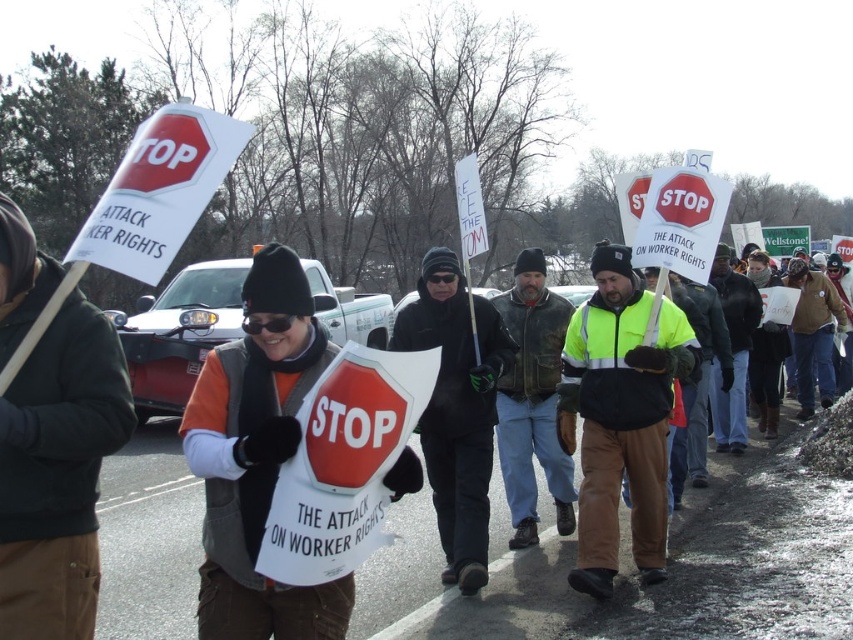
Is dark green jacket at left positioned in front of high-visibility yellow jacket at center?

Yes.

Based on the photo, is dark green jacket at left smaller than high-visibility yellow jacket at center?

Correct, dark green jacket at left occupies less space than high-visibility yellow jacket at center.

Where is `dark green jacket at left`? This screenshot has height=640, width=853. dark green jacket at left is located at coordinates (57, 472).

The image size is (853, 640). I want to click on dark green jacket at left, so click(57, 472).

Is dark green jacket at left wider than matte black vest at center?

In fact, dark green jacket at left might be narrower than matte black vest at center.

Between dark green jacket at left and matte black vest at center, which one has more height?

Standing taller between the two is matte black vest at center.

The height and width of the screenshot is (640, 853). Find the location of `dark green jacket at left`. dark green jacket at left is located at coordinates (57, 472).

This screenshot has height=640, width=853. What do you see at coordinates (57, 472) in the screenshot? I see `dark green jacket at left` at bounding box center [57, 472].

Is dark green jacket at left bigger than leather jacket at center?

Actually, dark green jacket at left might be smaller than leather jacket at center.

Between point (70, 545) and point (532, 474), which one is positioned in front?

Point (70, 545)

The image size is (853, 640). What are the coordinates of `dark green jacket at left` in the screenshot? It's located at click(57, 472).